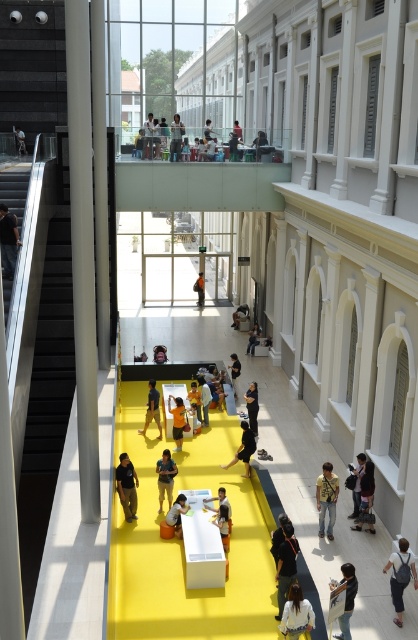
You are a photographer positioned at the entrance of the atrium. You notice two individuals wearing the white fabric shirt at lower center and the denim jacket at lower right. Which person should you adjust your camera angle upwards to capture properly?

The denim jacket at lower right is taller than the white fabric shirt at lower center, so you should adjust your camera angle upwards to capture the person wearing the denim jacket at lower right properly.

You are standing in the atrium and want to move from point A to point B. Point A is at coordinate point (241, 444) and point B is at coordinate point (180, 532). Since the yellow carpeted walkway is the only path available, which direction should you move to get closer to point B?

To move from point A at coordinate point (241, 444) to point B at coordinate point (180, 532), you should move towards the lower right direction because point B is located at a lower y and higher x coordinate compared to point A.

You are a visitor in the atrium and want to sit down. You see the black fabric pants at center and the light brown wooden chair at center. Which object is taller and would allow you to sit comfortably?

The black fabric pants at center is taller than the light brown wooden chair at center. However, the light brown wooden chair at center is designed for sitting, so you should sit on it instead of the pants.